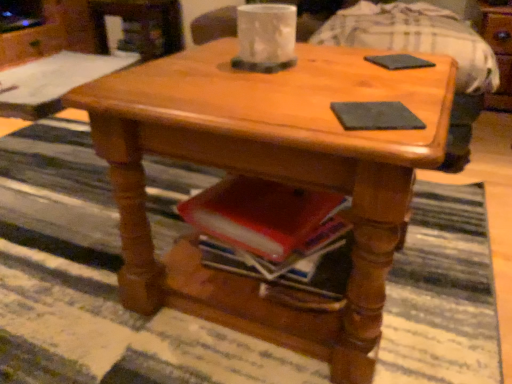
Question: Looking at the image, does black matte pad at center, which is the first pad from front to back, seem bigger or smaller compared to black matte pad at upper right, which appears as the 1th pad when viewed from the right?

Choices:
 (A) big
 (B) small

Answer: (B)

Question: Do you think black matte pad at center, which appears as the 2th pad when viewed from the top, is within black matte pad at upper right, placed as the 1th pad when sorted from top to bottom, or outside of it?

Choices:
 (A) outside
 (B) inside

Answer: (A)

Question: Based on their relative distances, which object is nearer to the matte black coaster at upper center?

Choices:
 (A) shiny wood coffee table at center
 (B) black matte pad at center, marked as the 1th pad in a left-to-right arrangement
 (C) black matte pad at upper right, which appears as the 1th pad when viewed from the right

Answer: (C)

Question: Which object is the farthest from the black matte pad at center, acting as the 2th pad starting from the back?

Choices:
 (A) matte black coaster at upper center
 (B) black matte pad at upper right, the 2th pad from the front
 (C) shiny wood coffee table at center

Answer: (A)